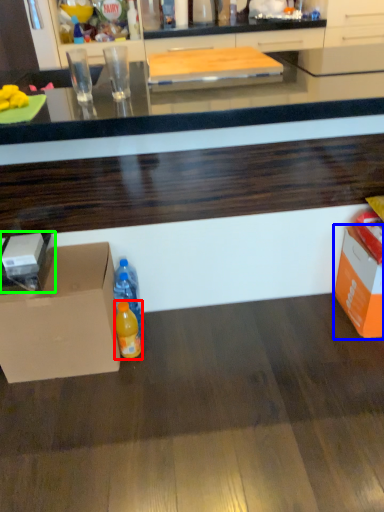
Question: Based on their relative distances, which object is nearer to bottle (highlighted by a red box)? Choose from storage box (highlighted by a blue box) and box (highlighted by a green box).

Choices:
 (A) storage box
 (B) box

Answer: (B)